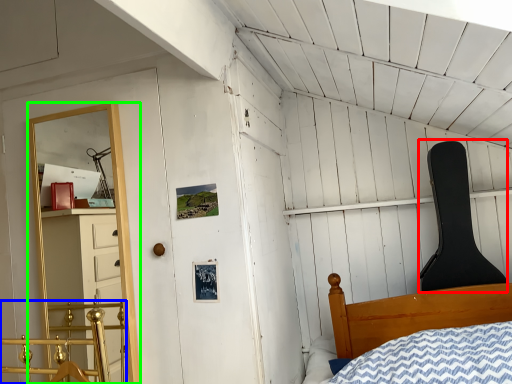
Question: Considering the real-world distances, which object is closest to chair (highlighted by a red box)? rail (highlighted by a blue box) or shelf (highlighted by a green box).

Choices:
 (A) rail
 (B) shelf

Answer: (B)